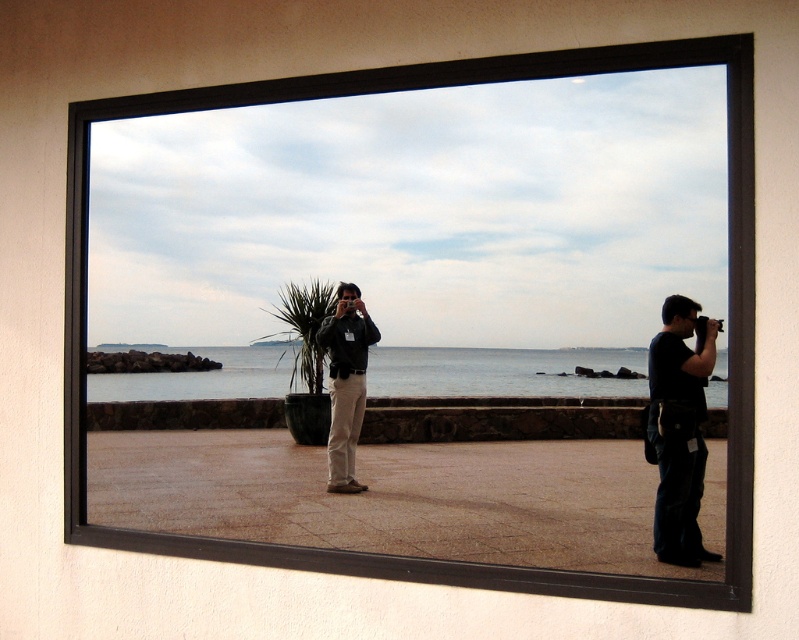
You are an interior designer planning to place a rectangular table between the blue water at center and the black matte camera at right. Given that the table must be narrower than both objects, can you confirm if the table will fit?

The blue water at center has a larger width than the black matte camera at right. Since the table must be narrower than both, it needs to be narrower than the smaller of the two. Therefore, the table can fit as long as its width is less than the black matte camera at right.

Consider the image. You are a photographer trying to capture the reflection in the window. You notice the black matte camera at right and the matte black jacket at center. Which object is positioned closer to your vantage point?

The black matte camera at right is closer to the viewer than the matte black jacket at center, so it is positioned closer to your vantage point.

You are a photographer standing in front of a large window. You see the blue water at center and the black matte camera at right in the reflection. Which object is closer to the left edge of the window?

The blue water at center is positioned on the left side of the black matte camera at right, so the blue water at center is closer to the left edge of the window.